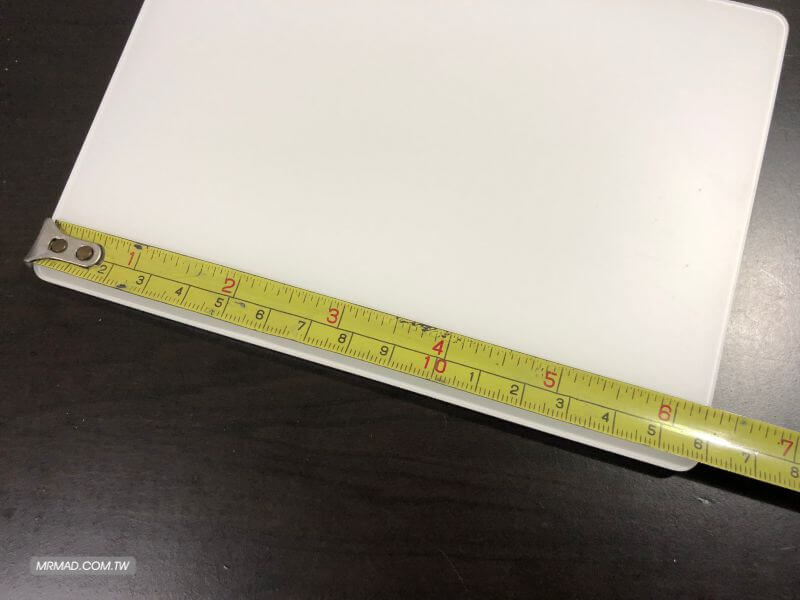
Find the location of a particular element. table is located at coordinates (334, 464).